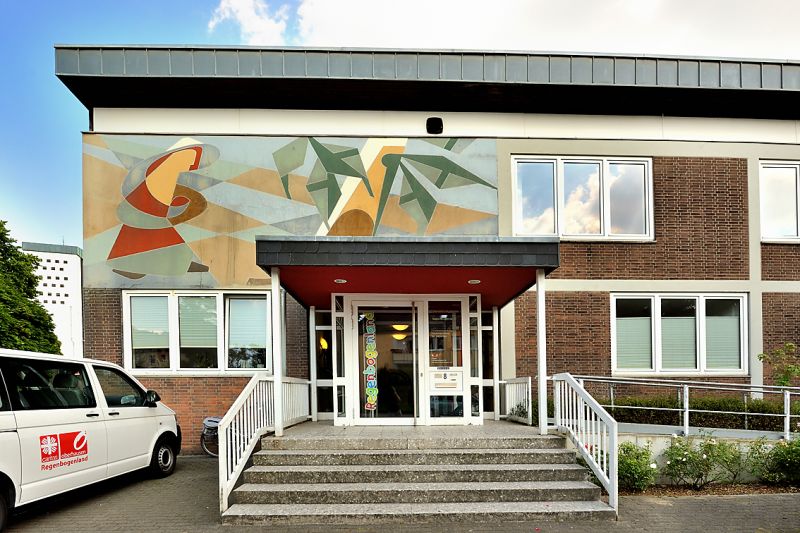
Where is `door sidelight`? door sidelight is located at coordinates (322, 320), (320, 352), (326, 400), (486, 317), (486, 348), (489, 395).